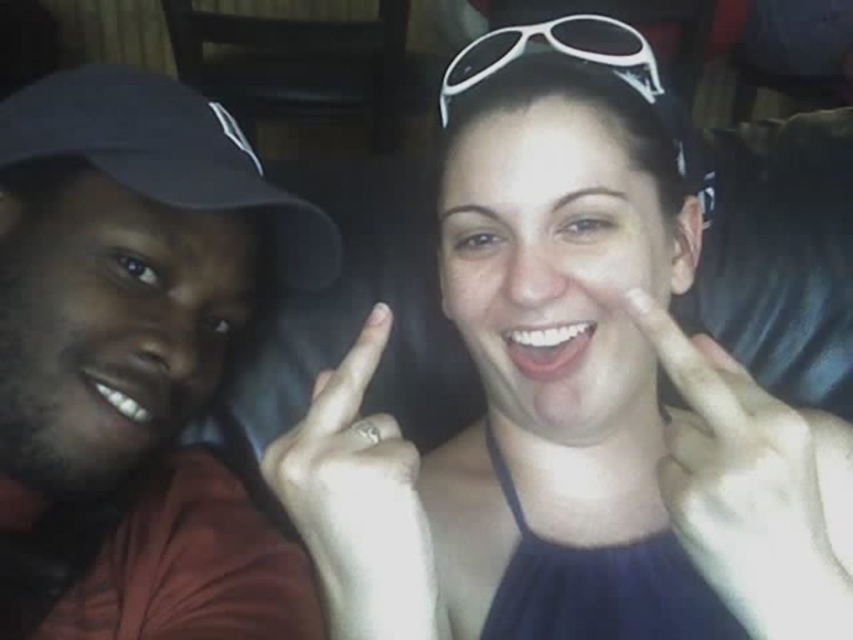
Question: From the image, what is the correct spatial relationship of white matte hand at center in relation to white plastic sunglasses at upper center?

Choices:
 (A) left
 (B) right

Answer: (B)

Question: Which object is the closest to the matte black cap at left?

Choices:
 (A) white matte sunglasses at upper center
 (B) black fabric baseball cap at left
 (C) white plastic sunglasses at upper center
 (D) white matte hand at center

Answer: (B)

Question: Can you confirm if black fabric baseball cap at left is wider than white plastic sunglasses at upper center?

Choices:
 (A) yes
 (B) no

Answer: (A)

Question: Among these points, which one is farthest from the camera?

Choices:
 (A) (144, 429)
 (B) (292, 260)

Answer: (B)

Question: Which is farther from the white plastic sunglasses at upper center?

Choices:
 (A) white matte ring at center
 (B) matte black cap at left

Answer: (B)

Question: Where is white matte ring at center located in relation to white plastic sunglasses at upper center in the image?

Choices:
 (A) above
 (B) below

Answer: (B)